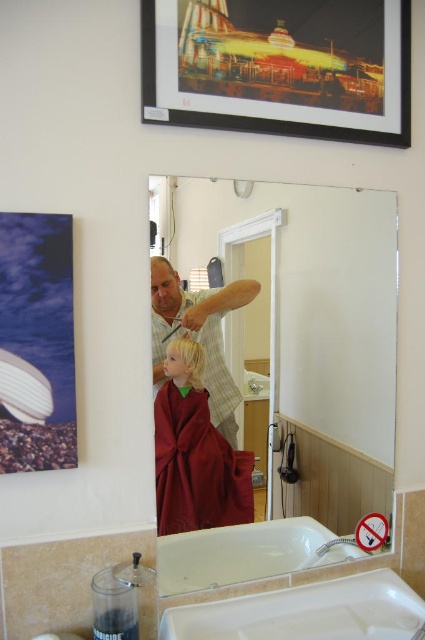
You are a customer in the hair salon and need to wash your hair after the haircut. Where is the white plastic sink at lower center located in the salon?

The white plastic sink at lower center is located at point coordinates of [306,612] in the salon.